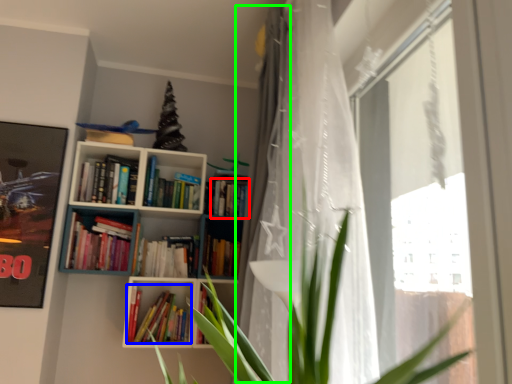
Question: Estimate the real-world distances between objects in this image. Which object is closer to book (highlighted by a red box), book (highlighted by a blue box) or curtain (highlighted by a green box)?

Choices:
 (A) book
 (B) curtain

Answer: (A)